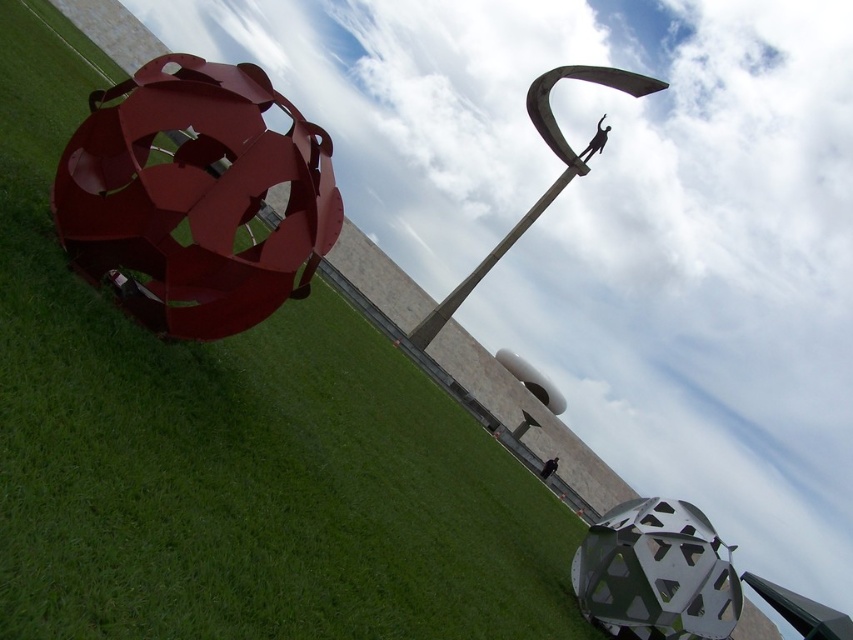
Question: Which point is closer to the camera taking this photo?

Choices:
 (A) (238, 64)
 (B) (558, 180)

Answer: (A)

Question: Is metallic sphere at center bigger than polished metal sculpture at upper center?

Choices:
 (A) no
 (B) yes

Answer: (A)

Question: From the image, what is the correct spatial relationship of metallic sphere at center in relation to rusty metal sphere at left?

Choices:
 (A) left
 (B) right

Answer: (A)

Question: Does rusty metal sphere at left lie behind polished metal sculpture at upper center?

Choices:
 (A) no
 (B) yes

Answer: (A)

Question: Which point appears closest to the camera in this image?

Choices:
 (A) (109, 275)
 (B) (570, 157)
 (C) (32, 368)

Answer: (C)

Question: Which of the following is the farthest from the observer?

Choices:
 (A) rusty metal sphere at left
 (B) polished metal sculpture at upper center

Answer: (B)